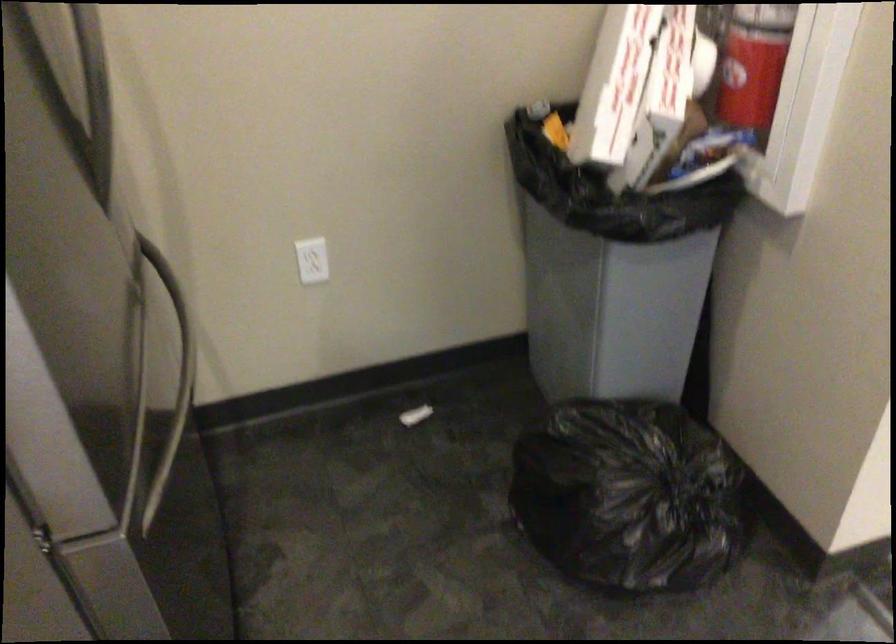
What do you see at coordinates (169, 380) in the screenshot? I see `the silver refrigerator handle` at bounding box center [169, 380].